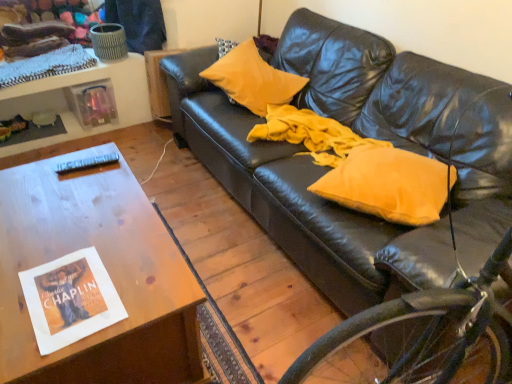
You are a GUI agent. You are given a task and a screenshot of the screen. Output one action in this format:
    pyautogui.click(x=<x>, y=<y>)
    Task: Click on the vacant region under white paper magazine at lower left (from a real-world perspective)
    This screenshot has height=384, width=512.
    Given the screenshot: What is the action you would take?
    pyautogui.click(x=68, y=292)